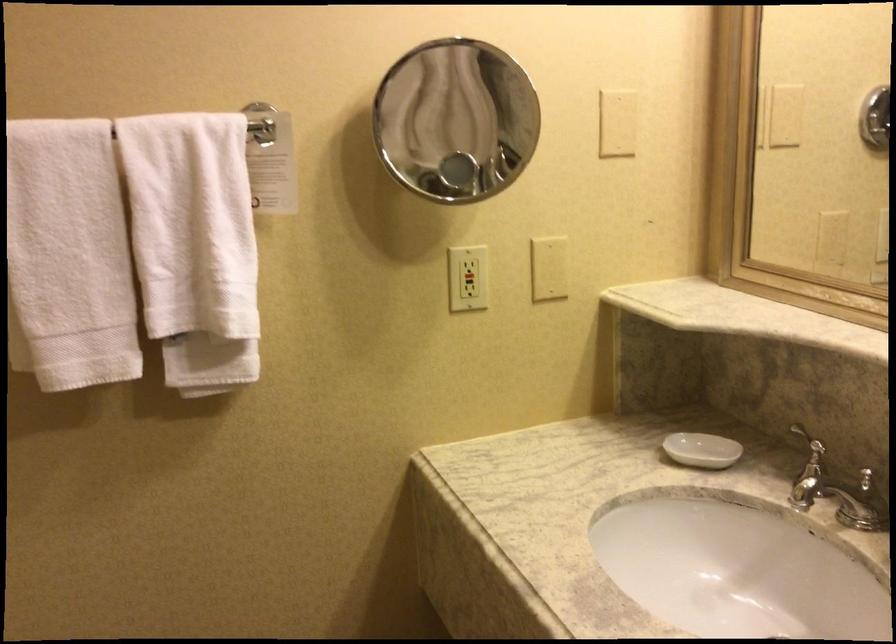
The height and width of the screenshot is (644, 896). What do you see at coordinates (808, 466) in the screenshot?
I see `the faucet drain lever` at bounding box center [808, 466].